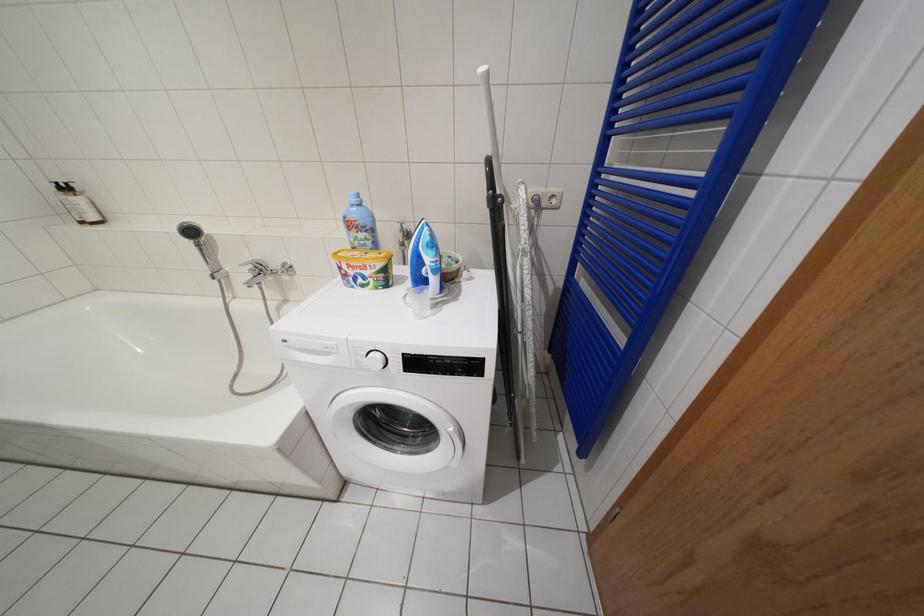
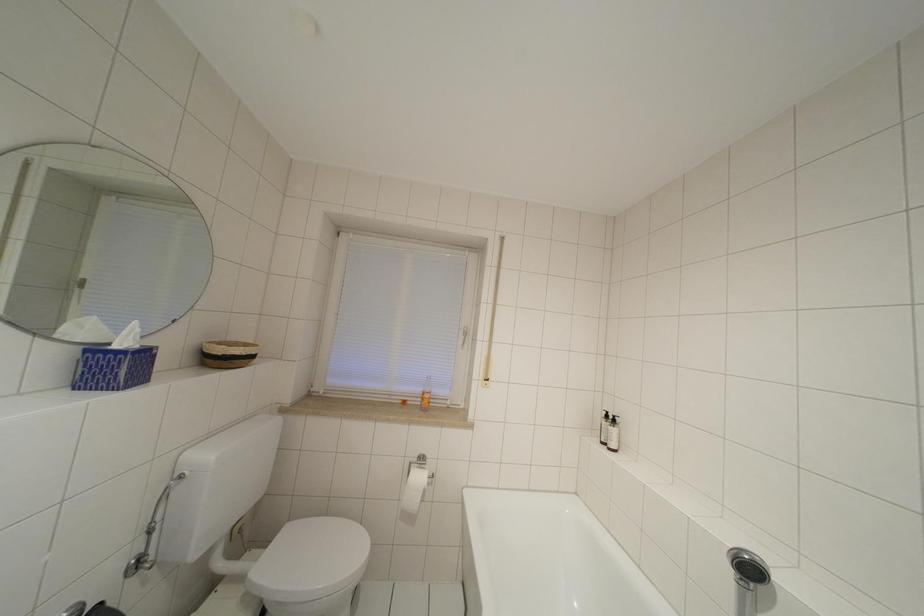
Question: The camera is either moving clockwise (left) or counter-clockwise (right) around the object. The first image is from the beginning of the video and the second image is from the end. Is the camera moving left or right when shooting the video?

Choices:
 (A) Left
 (B) Right

Answer: (B)